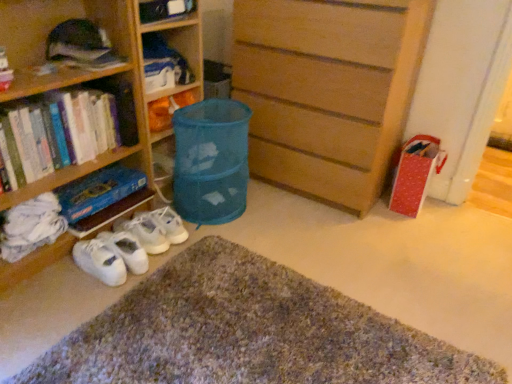
Question: Is matte plastic bag at center, which ranks as the 1th book in top-to-bottom order, at the right side of wooden chest of drawers at center?

Choices:
 (A) yes
 (B) no

Answer: (B)

Question: Does matte plastic bag at center, the 4th book ordered from the bottom, have a smaller size compared to wooden chest of drawers at center?

Choices:
 (A) no
 (B) yes

Answer: (B)

Question: Is the surface of matte plastic bag at center, which ranks as the 1th book in top-to-bottom order, in direct contact with wooden chest of drawers at center?

Choices:
 (A) yes
 (B) no

Answer: (B)

Question: Is matte plastic bag at center, the 4th book ordered from the bottom, positioned behind wooden chest of drawers at center?

Choices:
 (A) no
 (B) yes

Answer: (B)

Question: Is matte plastic bag at center, which ranks as the 1th book in top-to-bottom order, taller than wooden chest of drawers at center?

Choices:
 (A) no
 (B) yes

Answer: (A)

Question: From a real-world perspective, is matte plastic bag at center, which ranks as the 1th book in top-to-bottom order, on top of wooden chest of drawers at center?

Choices:
 (A) yes
 (B) no

Answer: (B)

Question: Is white fabric sneakers at lower left further to camera compared to blue fabric laundry basket at center?

Choices:
 (A) yes
 (B) no

Answer: (B)

Question: Considering the relative positions of white fabric sneakers at lower left and blue fabric laundry basket at center in the image provided, is white fabric sneakers at lower left to the right of blue fabric laundry basket at center from the viewer's perspective?

Choices:
 (A) no
 (B) yes

Answer: (A)

Question: From the image's perspective, is white fabric sneakers at lower left located above blue fabric laundry basket at center?

Choices:
 (A) no
 (B) yes

Answer: (A)

Question: Can you confirm if white fabric sneakers at lower left is taller than blue fabric laundry basket at center?

Choices:
 (A) no
 (B) yes

Answer: (A)

Question: Does white fabric sneakers at lower left touch blue fabric laundry basket at center?

Choices:
 (A) no
 (B) yes

Answer: (A)

Question: Is white fabric sneakers at lower left bigger than blue fabric laundry basket at center?

Choices:
 (A) no
 (B) yes

Answer: (A)

Question: Does wooden chest of drawers at center come behind hardcover book at lower left, the 2th book positioned from the bottom?

Choices:
 (A) yes
 (B) no

Answer: (A)